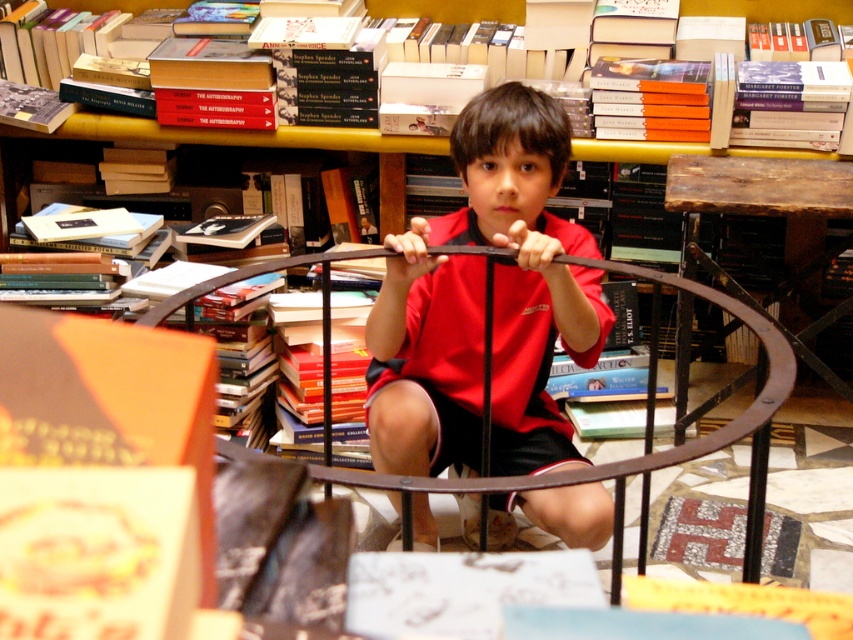
You are a delivery person who needs to place a package on the rustic wood table at center. The package is 1.5 meters long. Can you slide the hardcover book at upper center out of the way to make space?

The hardcover book at upper center and rustic wood table at center are 1.34 meters apart from each other. Since the package is 1.5 meters long, which is longer than the distance between them, sliding the hardcover book at upper center might not provide enough space for the package to fit on the rustic wood table at center.

Consider the image. You are a photographer trying to capture a wide shot of the scene. You need to ensure that the red matte shirt at center and the metallic bookshelf at upper center are both fully visible in the frame. Given their sizes, which object might require you to adjust your camera angle to avoid cropping?

The metallic bookshelf at upper center is wider than the red matte shirt at center, so you might need to adjust your camera angle to ensure the metallic bookshelf at upper center fits entirely within the frame without being cropped.

You are a delivery person who needs to place a package that is 1.5 meters long between the metallic bookshelf at upper center and the rustic wood table at center. Can you fit the package between them without bending it?

The distance between the metallic bookshelf at upper center and the rustic wood table at center is 1.35 meters. Since the package is 1.5 meters long, it cannot fit between them without bending because the space is shorter than the package.